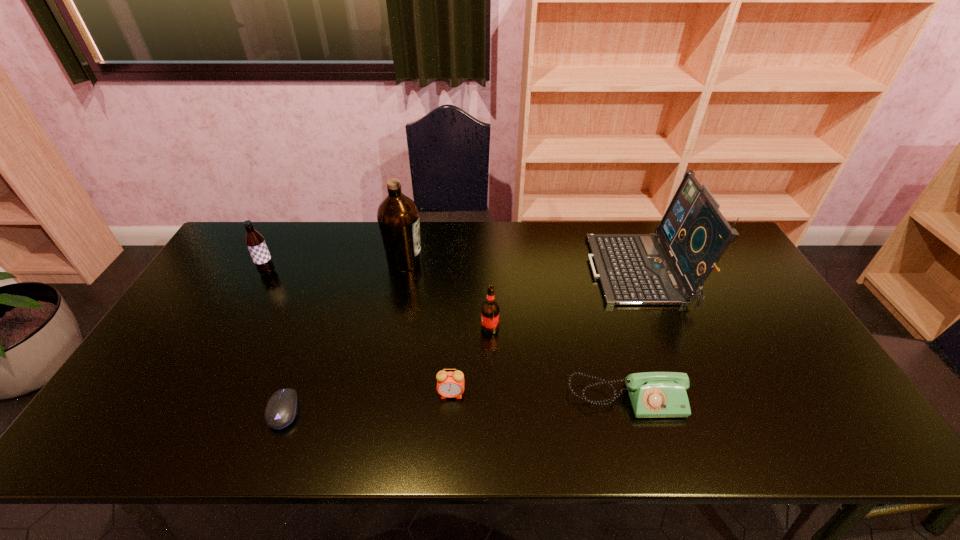
Locate an element on the screen. The width and height of the screenshot is (960, 540). olive oil is located at coordinates (398, 217).

Locate an element on the screen. The width and height of the screenshot is (960, 540). laptop computer is located at coordinates (633, 269).

What are the coordinates of `the left root beer` in the screenshot? It's located at [255, 242].

I want to click on the leftmost object, so [255, 242].

You are a GUI agent. You are given a task and a screenshot of the screen. Output one action in this format:
    pyautogui.click(x=<x>, y=<y>)
    Task: Click on the fifth object from left to right
    
    Given the screenshot: What is the action you would take?
    pyautogui.click(x=490, y=309)

This screenshot has width=960, height=540. I want to click on the fourth farthest object, so click(490, 309).

This screenshot has width=960, height=540. What are the coordinates of `the fifth tallest object` in the screenshot? It's located at (449, 384).

Where is `alarm clock`? The image size is (960, 540). alarm clock is located at coordinates (449, 384).

At what (x,y) coordinates should I click in order to perform the action: click on the second shortest object. Please return your answer as a coordinate pair (x, y). Looking at the image, I should click on (652, 394).

The image size is (960, 540). In order to click on computer mouse in this screenshot , I will do `click(282, 407)`.